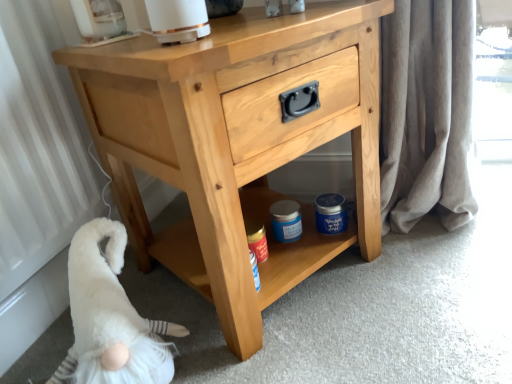
Question: From the image's perspective, is white fluffy gnome at lower left located above or below light wood chest of drawers at center?

Choices:
 (A) above
 (B) below

Answer: (B)

Question: Considering their positions, is white fluffy gnome at lower left located in front of or behind light wood chest of drawers at center?

Choices:
 (A) front
 (B) behind

Answer: (B)

Question: Is white fluffy gnome at lower left to the left or to the right of light wood chest of drawers at center in the image?

Choices:
 (A) left
 (B) right

Answer: (A)

Question: From the image's perspective, is light wood chest of drawers at center above or below white fluffy gnome at lower left?

Choices:
 (A) below
 (B) above

Answer: (B)

Question: Considering the positions of light wood chest of drawers at center and white fluffy gnome at lower left in the image, is light wood chest of drawers at center taller or shorter than white fluffy gnome at lower left?

Choices:
 (A) tall
 (B) short

Answer: (A)

Question: Does point (372, 195) appear closer or farther from the camera than point (71, 294)?

Choices:
 (A) closer
 (B) farther

Answer: (B)

Question: Is light wood chest of drawers at center spatially inside white fluffy gnome at lower left, or outside of it?

Choices:
 (A) inside
 (B) outside

Answer: (B)